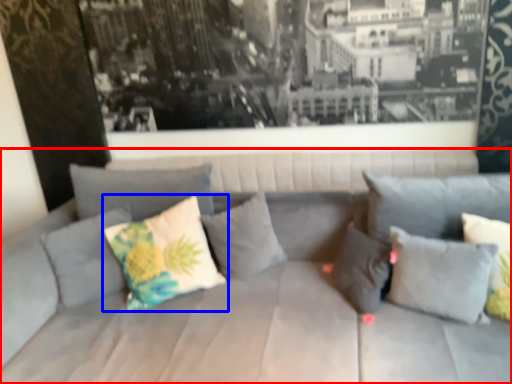
Question: Which of the following is the closest to the observer, studio couch (highlighted by a red box) or pillow (highlighted by a blue box)?

Choices:
 (A) studio couch
 (B) pillow

Answer: (A)